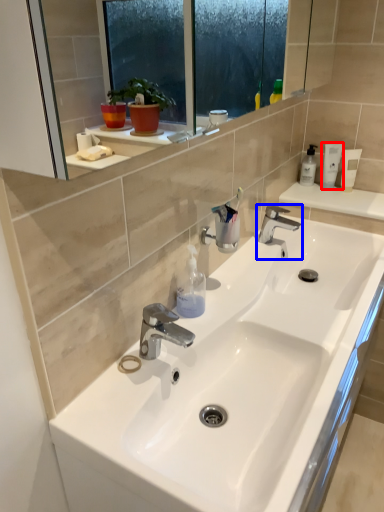
Question: Which object appears closest to the camera in this image, toiletry (highlighted by a red box) or tap (highlighted by a blue box)?

Choices:
 (A) toiletry
 (B) tap

Answer: (B)